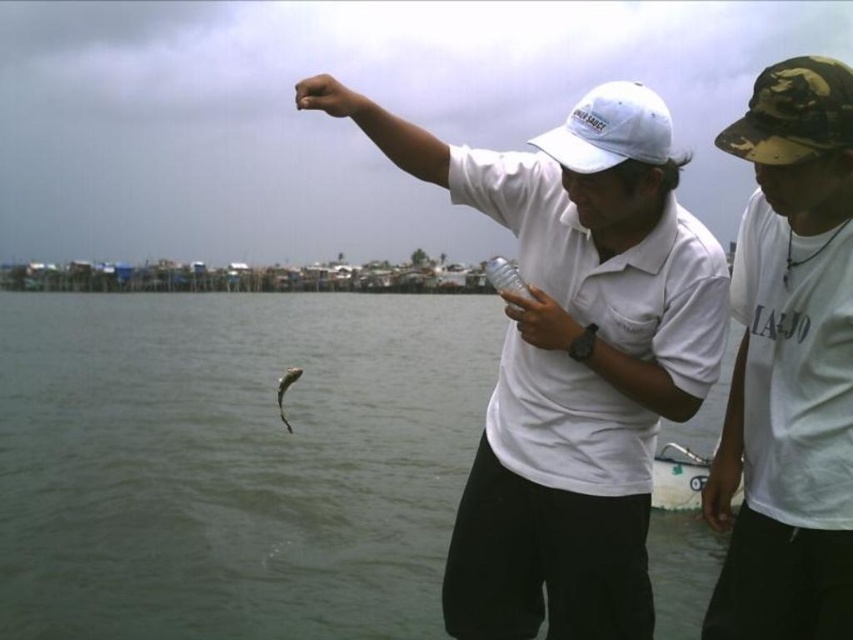
Question: Estimate the real-world distances between objects in this image. Which object is farther from the camouflage fabric baseball cap at upper right?

Choices:
 (A) white plastic boat at lower right
 (B) white matte baseball cap at center
 (C) shiny silver fish at center

Answer: (C)

Question: Can you confirm if white matte baseball cap at center is positioned above shiny silver fish at center?

Choices:
 (A) no
 (B) yes

Answer: (B)

Question: Which of these objects is positioned closest to the camouflage fabric cap at upper right?

Choices:
 (A) greenish water at center
 (B) clear plastic bottle at center

Answer: (B)

Question: Does camouflage fabric cap at upper right appear under clear plastic bottle at center?

Choices:
 (A) no
 (B) yes

Answer: (B)

Question: Considering the relative positions of greenish water at center and camouflage fabric baseball cap at upper right in the image provided, where is greenish water at center located with respect to camouflage fabric baseball cap at upper right?

Choices:
 (A) above
 (B) below

Answer: (B)

Question: Which of the following is the farthest from the observer?

Choices:
 (A) (746, 154)
 (B) (286, 385)
 (C) (486, 385)
 (D) (682, 509)

Answer: (C)